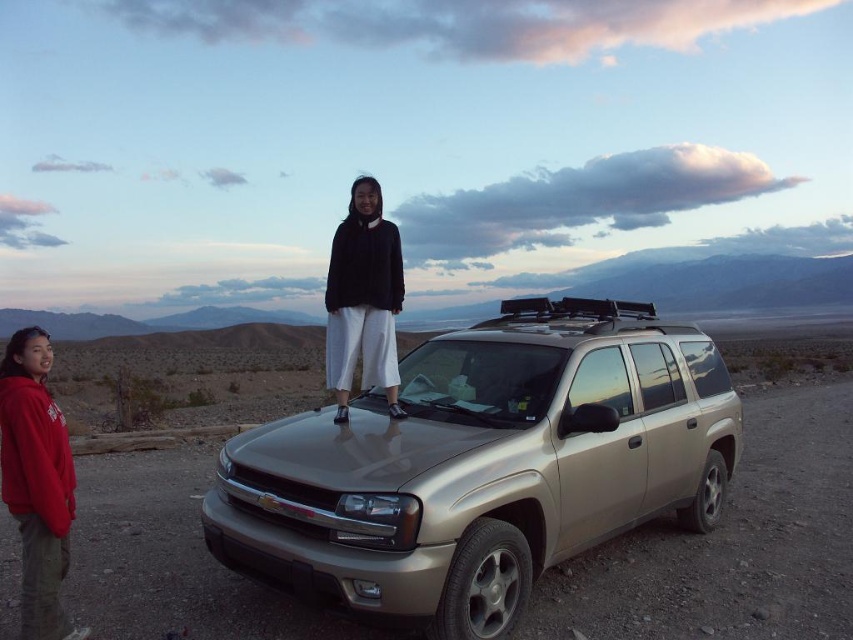
You are a photographer planning to take a photo of the satin gold suv at center and the black matte sweater at center in the desert landscape. Based on their sizes, which object should you focus on first if you want to ensure both are in frame without moving the camera?

The satin gold suv at center is wider than the black matte sweater at center, so you should focus on the satin gold suv at center first to ensure both fit in the frame.

You are a photographer trying to capture a photo of the red fleece jacket at lower left and the satin gold suv at center. From your current position, which object would you need to pan your camera to the right to include in the frame?

The satin gold suv at center is to the right of the red fleece jacket at lower left, so to include the satin gold suv at center in the frame, you would need to pan your camera to the right from the red fleece jacket at lower left.

You are driving a car and need to park it in a parking spot that is exactly 3.3 meters long. You see the satin gold suv at center and the red fleece jacket at lower left in the scene. Based on their distance apart, can you determine if the parking spot will be long enough to accommodate your car?

The satin gold suv at center is 3.31 meters away from red fleece jacket at lower left. Since the parking spot is 3.3 meters long, it is slightly shorter than the distance between the two objects. Therefore, the parking spot may not be long enough to accommodate your car.